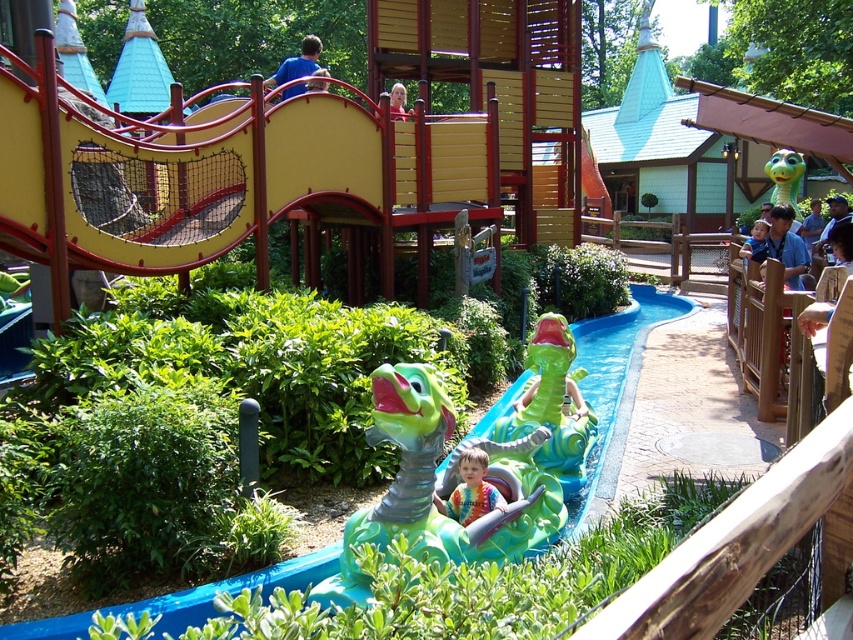
Looking at this image, you are a photographer at the theme park and want to capture both the blue denim shirt at upper right and the green rubber crocodile at center in a single photo. Which object should you focus on first to ensure both are in frame?

The blue denim shirt at upper right is taller than the green rubber crocodile at center, so focusing on the blue denim shirt at upper right first will help ensure both are in frame.